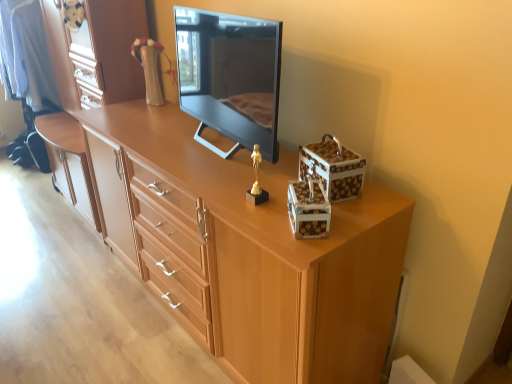
Find the location of `unoccupied area in front of gold metallic statue at center`. unoccupied area in front of gold metallic statue at center is located at coordinates (266, 219).